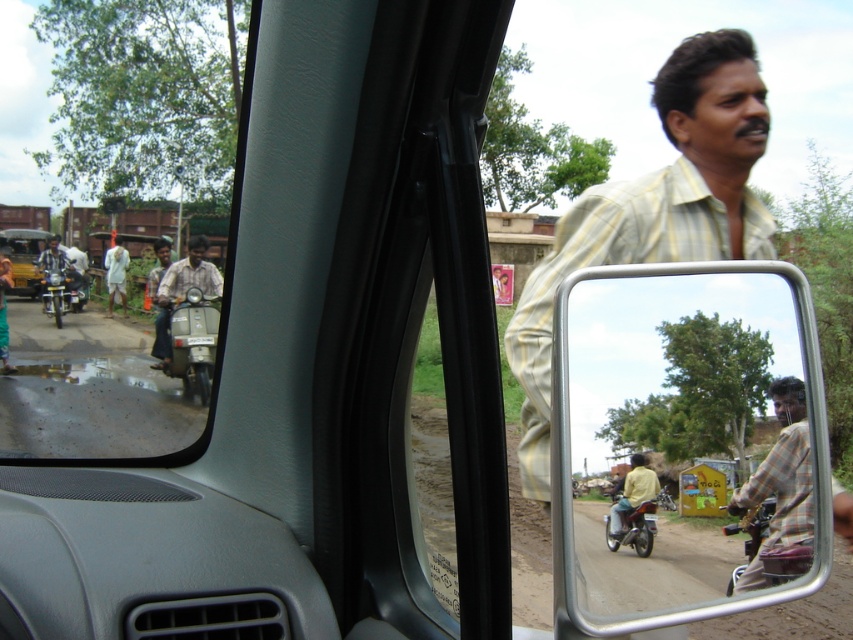
Question: Does plaid fabric shirt at right have a larger size compared to metallic silver scooter at left?

Choices:
 (A) yes
 (B) no

Answer: (B)

Question: Which object is the farthest from the plaid fabric shirt at right?

Choices:
 (A) metallic silver scooter at left
 (B) matte gray scooter at left

Answer: (B)

Question: Which object appears farthest from the camera in this image?

Choices:
 (A) silver metallic mirror at right
 (B) white cotton shirt at left
 (C) matte black auto-rickshaw at left
 (D) plaid fabric shirt at right

Answer: (C)

Question: Does clear glass window at upper left have a greater width compared to metallic silver scooter at left?

Choices:
 (A) yes
 (B) no

Answer: (A)

Question: Which point is closer to the camera?

Choices:
 (A) yellow shirt at right
 (B) yellow striped shirt at upper right

Answer: (A)

Question: Is the position of matte gray scooter at left more distant than that of light blue fabric shirt at left?

Choices:
 (A) no
 (B) yes

Answer: (A)